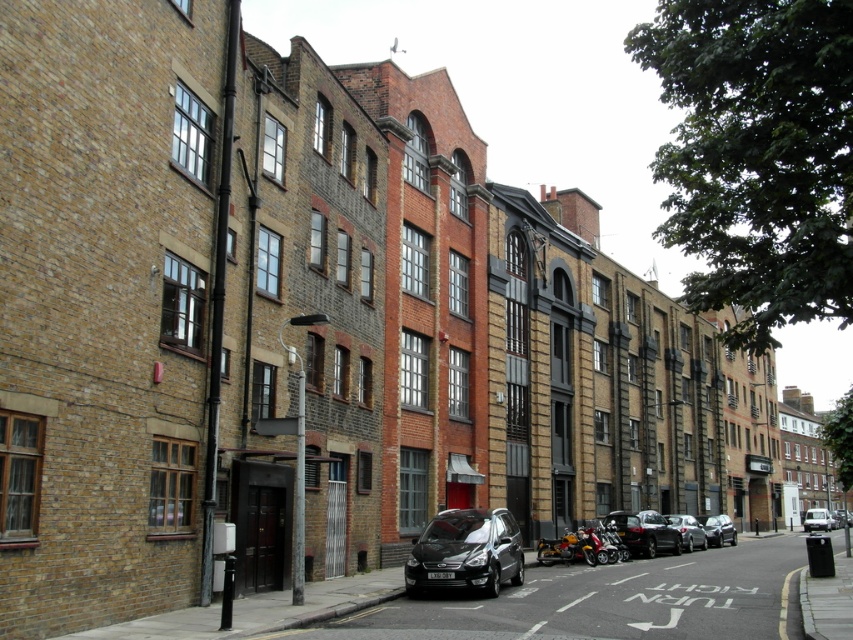
You are driving a delivery truck and need to exit the street. You see a shiny silver car at center and a silver metallic van at center blocking your path. Which vehicle should you move first to clear the path?

The shiny silver car at center is in front of the silver metallic van at center, so you should move the shiny silver car at center first to clear the path.

You are driving a car and see the black metallic car at center and the shiny black car at center. Which one is nearer to you?

The black metallic car at center is closer to the viewer than the shiny black car at center.